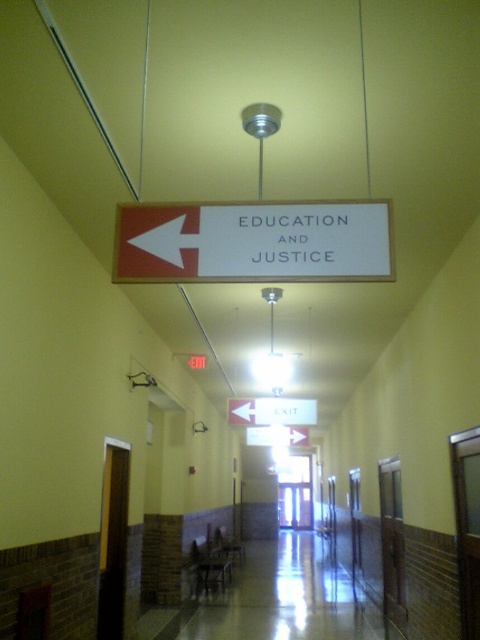
Is white matte sign at center positioned at the back of white matte arrow at upper left?

→ No, white matte sign at center is closer to the viewer.

Is point (267, 234) farther from viewer compared to point (162, 257)?

Yes, point (267, 234) is farther from viewer.

Find the location of `white matte sign at center`. white matte sign at center is located at coordinates (253, 243).